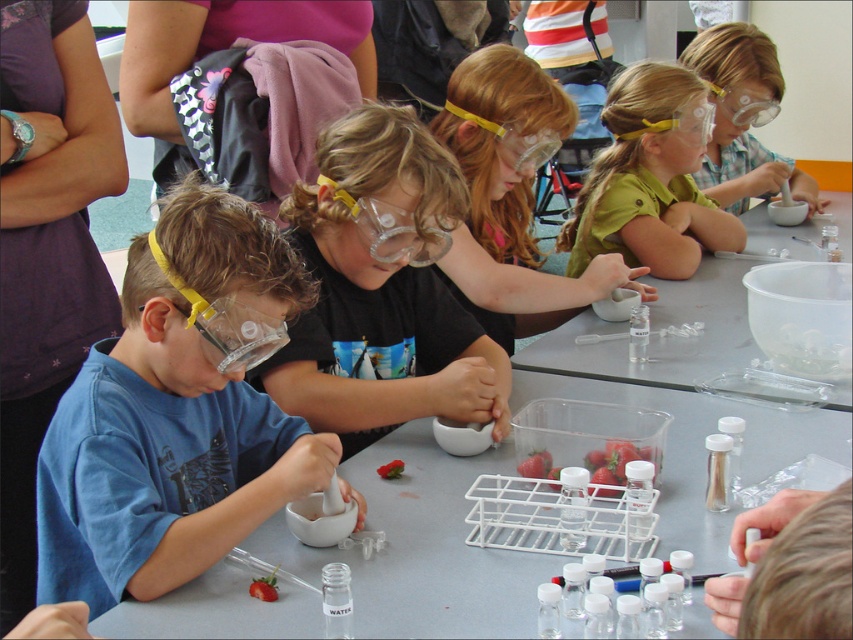
Which is in front, point (558, 316) or point (610, 152)?

Point (558, 316) is more forward.

Measure the distance between point (509, 244) and camera.

Point (509, 244) is 2.28 meters away from camera.

Find the location of a particular element. The width and height of the screenshot is (853, 640). matte black mortar at center is located at coordinates coord(511,196).

Locate an element on the screen. matte black mortar at center is located at coordinates (511, 196).

How distant is white matte mortar at lower left from clear plastic mortar at center?

They are 11.50 inches apart.

Does point (200, 577) come farther from viewer compared to point (305, 186)?

No, it is not.

Identify the location of white matte mortar at lower left. The width and height of the screenshot is (853, 640). (422, 548).

Does matte black mortar at center have a greater height compared to clear plastic bowl at center?

Yes.

Between point (485, 282) and point (752, 209), which one is positioned behind?

The point (752, 209) is behind.

Who is more forward, [524,116] or [646,372]?

Point [646,372]

Locate an element on the screen. The width and height of the screenshot is (853, 640). matte black mortar at center is located at coordinates (511, 196).